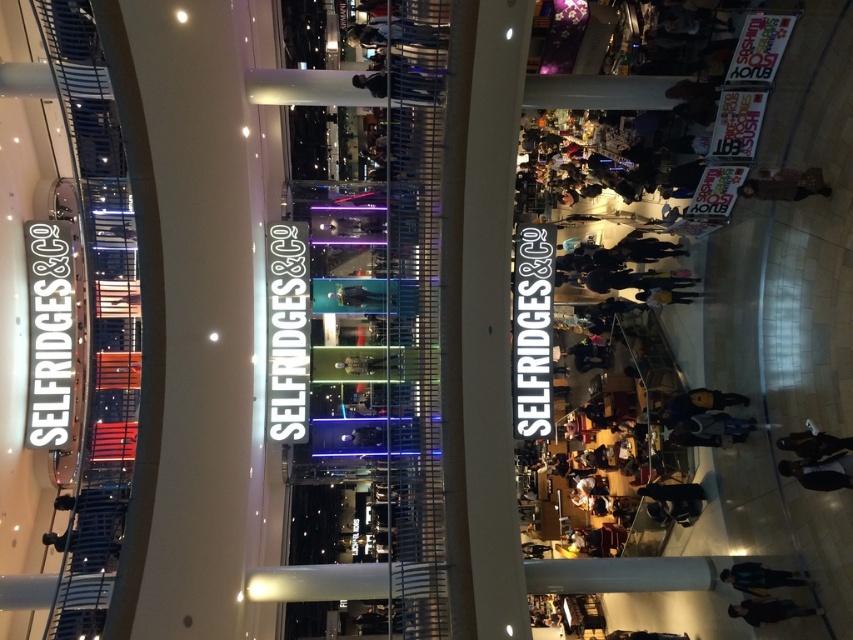
You are standing at the entrance of Selfridges and see both the dark blue jacket at lower right and the dark gray jacket at lower center. Which jacket is positioned further to the right side of the entrance?

The dark blue jacket at lower right is positioned further to the right side of the entrance compared to the dark gray jacket at lower center.

You are standing on the upper level of the mall looking down at the entrance of Selfridges. You see the dark blue jeans at lower right and the dark gray jacket at lower center. Which item is positioned higher from your viewpoint?

The dark blue jeans at lower right is located above the dark gray jacket at lower center, so from your viewpoint on the upper level, the dark blue jeans at lower right is positioned higher.

You are standing at the upper level of the shopping mall entrance and want to see both the dark blue jeans at lower right and the dark blue jacket at lower right. Which one is closer to you?

→ The dark blue jeans at lower right is in front of the dark blue jacket at lower right, so the dark blue jeans at lower right is closer to you.